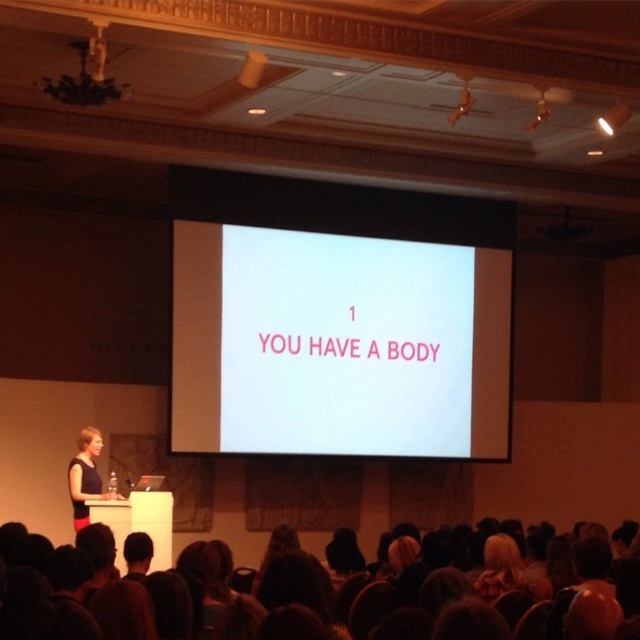
You are sitting in the audience and want to determine which of the two points, point (x=276, y=294) or point (x=19, y=616), is closer to you. Based on the scene, which point is nearer?

Point (x=19, y=616) is closer to you because it is positioned closer to the camera compared to point (x=276, y=294), which is further away.

You are a photographer in the audience at this presentation. You want to take a photo of both the dark hair at lower center and the blonde hair at lower center so that both are visible in the frame. Based on their positions, which one should you focus on first to ensure both are in the shot?

The dark hair at lower center is positioned on the left side of blonde hair at lower center. To capture both in the frame, focus on the dark hair at lower center first since it is on the left, allowing the photographer to adjust the shot to include the blonde hair at lower center on the right.

You are an attendee in the conference hall and want to take a photo of the slide on the projection screen. The screen is at point (337, 344). If your camera has a standard 50mm lens, which has a field of view of 46 degrees, can you capture the entire slide from your current position?

The white matte projection screen at center is located at point (337, 344). To determine if the entire slide can be captured, calculate the distance from your position to the screen. If the screen fits within the 46 degree field of view, then yes. However, without knowing the exact distance or screen size, it is impossible to confirm. More information is needed.